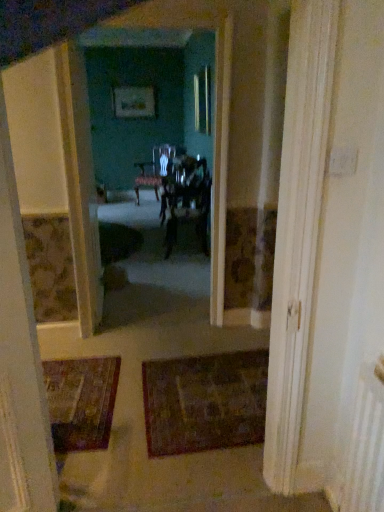
Question: In terms of height, does matte white door at center look taller or shorter compared to dark brown textured rug at center?

Choices:
 (A) tall
 (B) short

Answer: (A)

Question: Is matte white door at center in front of or behind dark brown textured rug at center in the image?

Choices:
 (A) front
 (B) behind

Answer: (B)

Question: Which of these objects is positioned closest to the wooden glossy chair at center, which is the first chair in right-to-left order?

Choices:
 (A) matte black chair at center, the second chair from the front
 (B) dark brown textured rug at center
 (C) matte white door at center

Answer: (A)

Question: Estimate the real-world distances between objects in this image. Which object is closer to the wooden glossy chair at center, the second chair viewed from the top?

Choices:
 (A) dark brown textured rug at center
 (B) matte black chair at center, which appears as the first chair when viewed from the top
 (C) matte white door at center

Answer: (B)